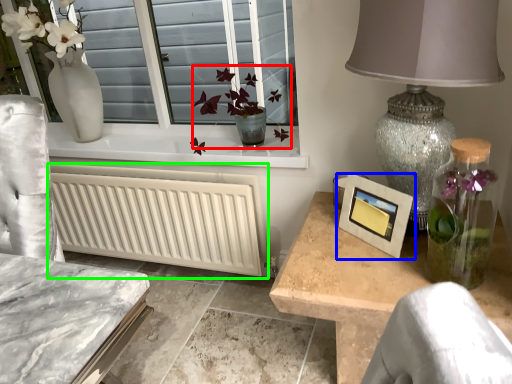
Question: Which is nearer to the floral arrangement (highlighted by a red box)? picture frame (highlighted by a blue box) or radiator (highlighted by a green box).

Choices:
 (A) picture frame
 (B) radiator

Answer: (B)